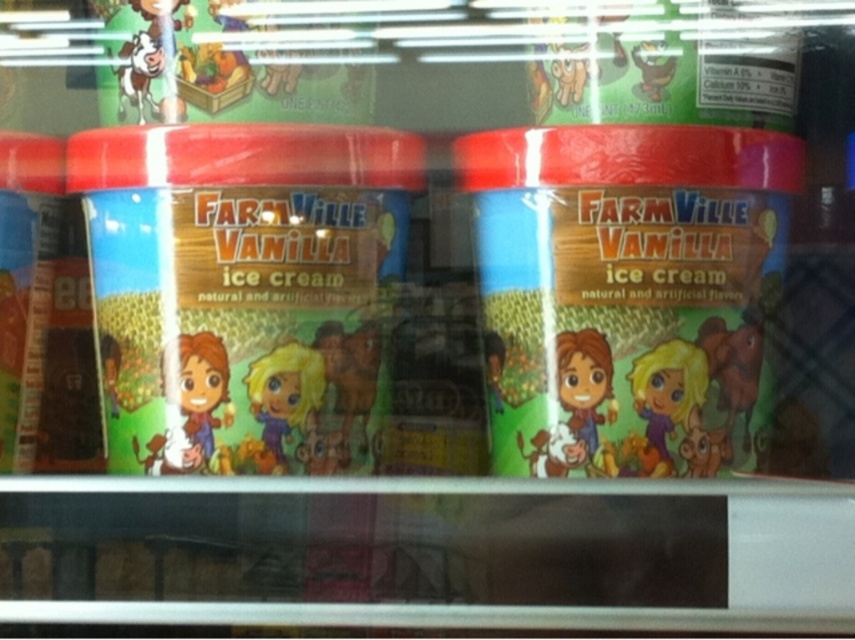
You are standing in front of the refrigerated display case looking at the two containers of Farmville Vanilla Ice Cream. Which of the two points, point (x=325, y=266) or point (x=657, y=204), appears closer to you?

Point (x=325, y=266) appears closer to you because it is further to the viewer than point (x=657, y=204).

You are a customer at the store looking at the refrigerated display case. You want to grab the matte plastic farmville vanilla ice cream at center and the matte plastic tub at left. Which one can you reach first without moving your position?

The matte plastic farmville vanilla ice cream at center is closer to the viewer than the matte plastic tub at left, so you can reach it first without moving.

Where is the matte plastic ice cream container at center located in the image?

The matte plastic ice cream container at center is located at point [240,289] in the image.